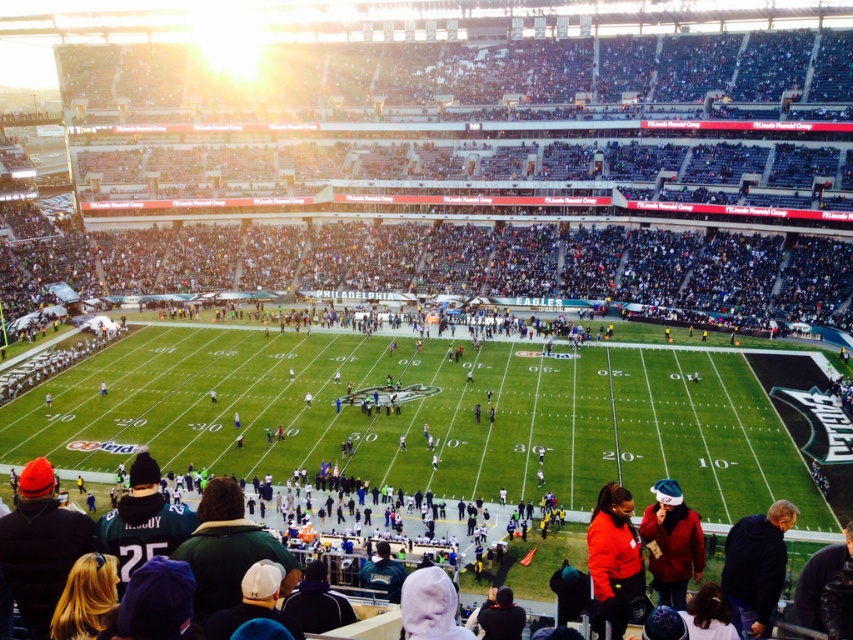
Does orange fleece jacket at lower center appear on the right side of red matte jacket at lower right?

In fact, orange fleece jacket at lower center is to the left of red matte jacket at lower right.

Consider the image. Can you confirm if orange fleece jacket at lower center is thinner than red matte jacket at lower right?

Yes, orange fleece jacket at lower center is thinner than red matte jacket at lower right.

Who is more distant from viewer, (610, 596) or (660, 522)?

The point (660, 522) is behind.

At what (x,y) coordinates should I click in order to perform the action: click on orange fleece jacket at lower center. Please return your answer as a coordinate pair (x, y). Looking at the image, I should click on (613, 557).